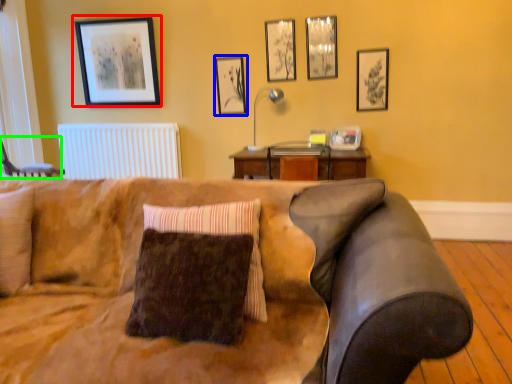
Question: Based on their relative distances, which object is nearer to picture frame (highlighted by a red box)? Choose from picture frame (highlighted by a blue box) and swivel chair (highlighted by a green box).

Choices:
 (A) picture frame
 (B) swivel chair

Answer: (A)